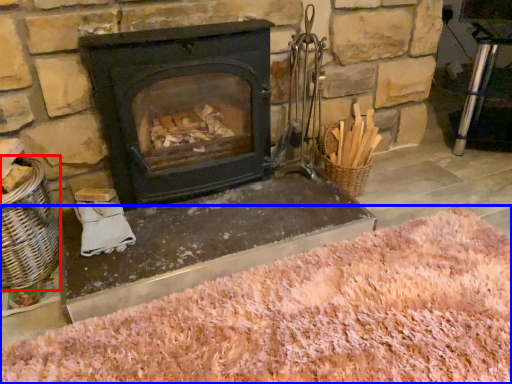
Question: Which object is further to the camera taking this photo, basket (highlighted by a red box) or sand (highlighted by a blue box)?

Choices:
 (A) basket
 (B) sand

Answer: (A)